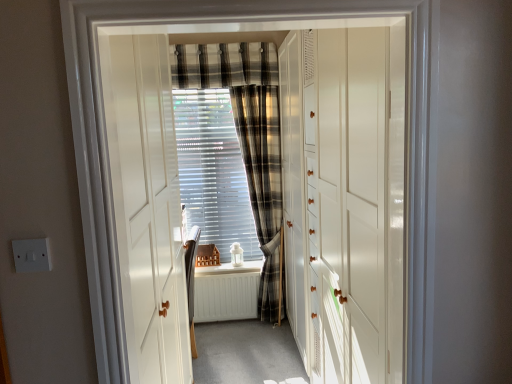
Where is `free point above plaid fabric curtain at center, positioned as the 1th curtain in bottom-to-top order (from a real-world perspective)`? The height and width of the screenshot is (384, 512). free point above plaid fabric curtain at center, positioned as the 1th curtain in bottom-to-top order (from a real-world perspective) is located at coordinates (251, 79).